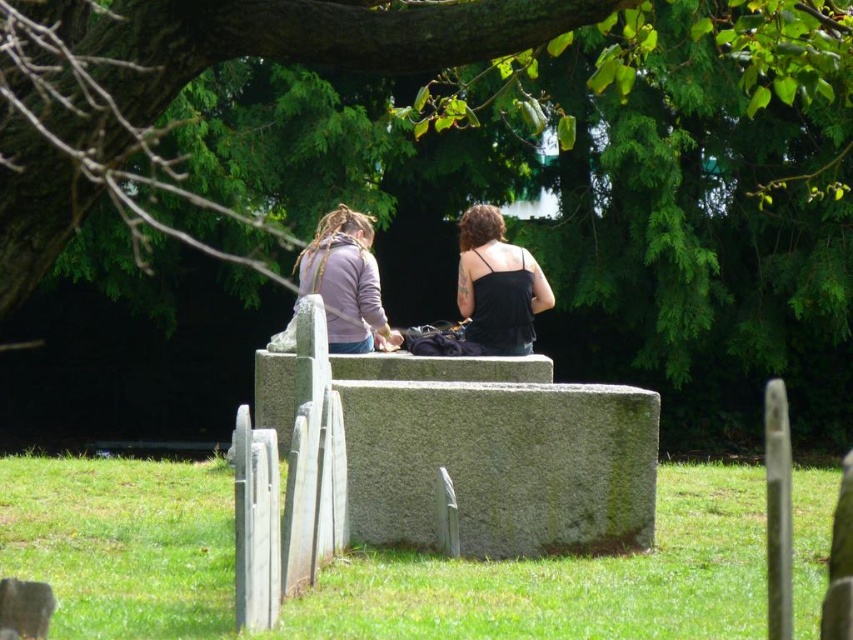
Is green leafy tree at upper center further to the viewer compared to black satin tank top at center?

That is False.

Is green leafy tree at upper center smaller than black satin tank top at center?

No, green leafy tree at upper center is not smaller than black satin tank top at center.

Is point (120, 188) farther from camera compared to point (514, 256)?

Yes.

Image resolution: width=853 pixels, height=640 pixels. I want to click on green leafy tree at upper center, so pyautogui.click(x=218, y=61).

Can you confirm if green mossy stone at center is thinner than green leafy tree at upper center?

Yes.

Is green mossy stone at center smaller than green leafy tree at upper center?

Indeed, green mossy stone at center has a smaller size compared to green leafy tree at upper center.

Where is `green mossy stone at center`? green mossy stone at center is located at coordinates (370, 564).

Who is more distant from viewer, (514, 317) or (361, 346)?

Positioned behind is point (361, 346).

Is point (474, 278) positioned after point (358, 264)?

Yes, point (474, 278) is behind point (358, 264).

The image size is (853, 640). I want to click on black satin tank top at center, so click(x=497, y=284).